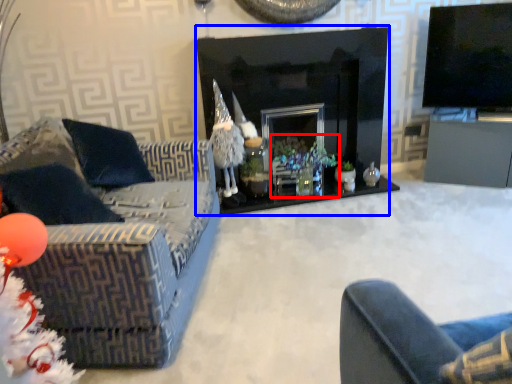
Question: Which object is closer to the camera taking this photo, christmas decoration (highlighted by a red box) or fireplace (highlighted by a blue box)?

Choices:
 (A) christmas decoration
 (B) fireplace

Answer: (B)